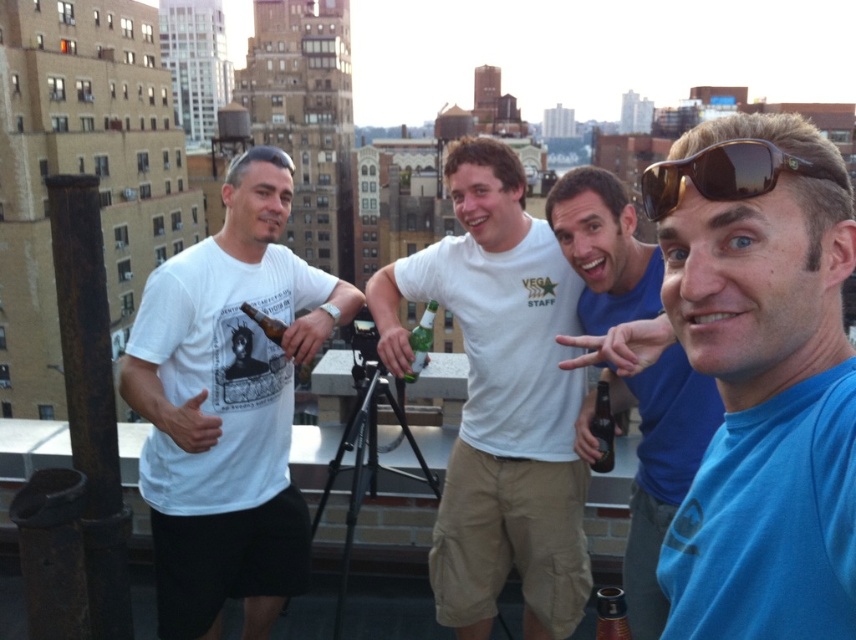
Based on the scene description, which object is positioned closer to the observer between the green glass bottle at center and the matte glass beer bottle at center?

The green glass bottle at center is closer to the observer since the matte glass beer bottle at center is positioned behind it.

You are a photographer standing 10 meters away from the blue matte shirt at center and green glass bottle at center. You want to take a photo of both objects in the same frame. Can you do it without moving your camera? Explain why or why not.

The blue matte shirt at center is 13.20 meters away from the green glass bottle at center. Since you are standing 10 meters away from both objects, the distance between them is greater than your distance from them. This means they are spread out beyond the camera frame at this distance, making it difficult to capture both in the same shot without moving the camera.

You are a photographer trying to capture a closeup shot of the brown reflective sunglasses at upper right and the green glass bottle at center. Since you want both items to appear the same size in the photo, which object should you move closer to the camera?

The brown reflective sunglasses at upper right has a smaller size compared to green glass bottle at center. To make them appear the same size in the photo, you should move the brown reflective sunglasses at upper right closer to the camera because it is smaller and needs to be magnified more to match the size of the green glass bottle at center.